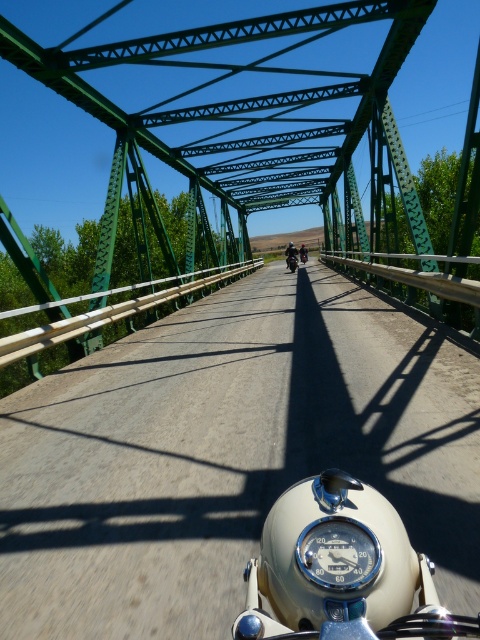
You are a delivery rider on a shiny black motorcycle at center. You need to cross the green metallic bridge at center. The bridge has a maximum load capacity of 15 metric tons. Your motorcycle weighs 300 kg. Can you safely cross the bridge?

The green metallic bridge at center has a maximum load capacity of 15 metric tons, which is 15,000 kg. Since the shiny black motorcycle at center weighs only 300 kg, it is well within the bridge capacity. Therefore, you can safely cross the green metallic bridge at center.

You are a rider checking your motorcycle before a long trip. You notice the white glossy speedometer at center and the shiny black motorcycle at center. Which object is smaller in size?

The white glossy speedometer at center is smaller in size compared to the shiny black motorcycle at center.

Based on the photo, you are a motorcyclist on a bridge. You need to locate the green metallic bridge at center. Where exactly is it positioned in the scene?

The green metallic bridge at center is positioned at point (233, 88) in the scene.